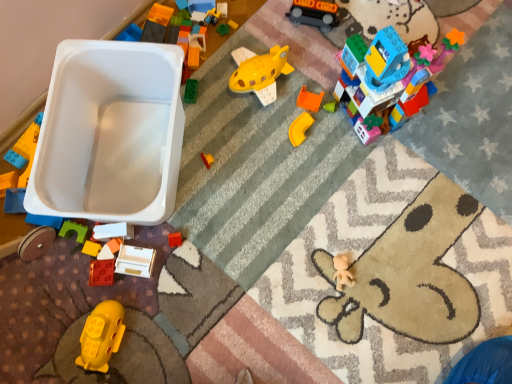
Find the location of a particular element. The width and height of the screenshot is (512, 384). free space to the back side of rubber brick at lower left, positioned as the seventh toy in right-to-left order is located at coordinates (114, 206).